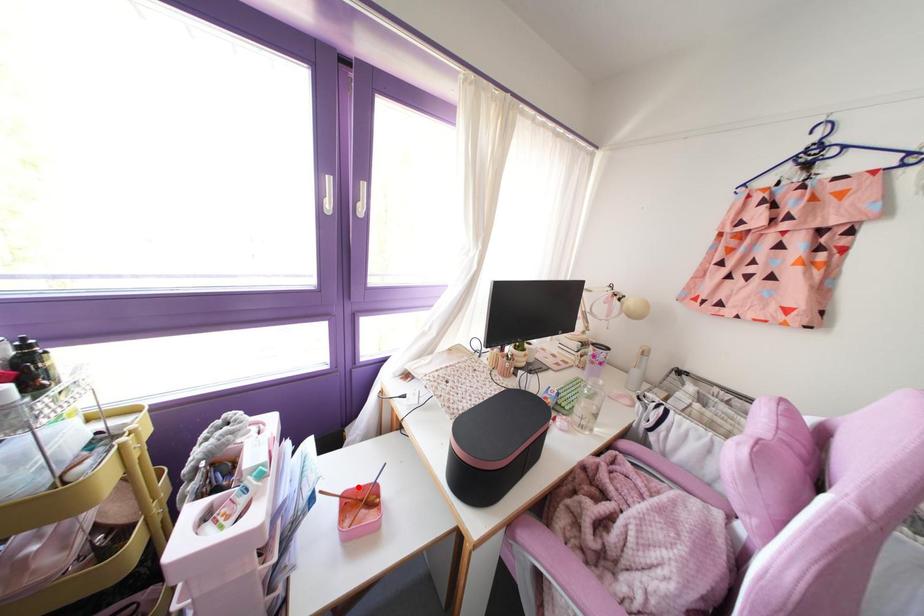
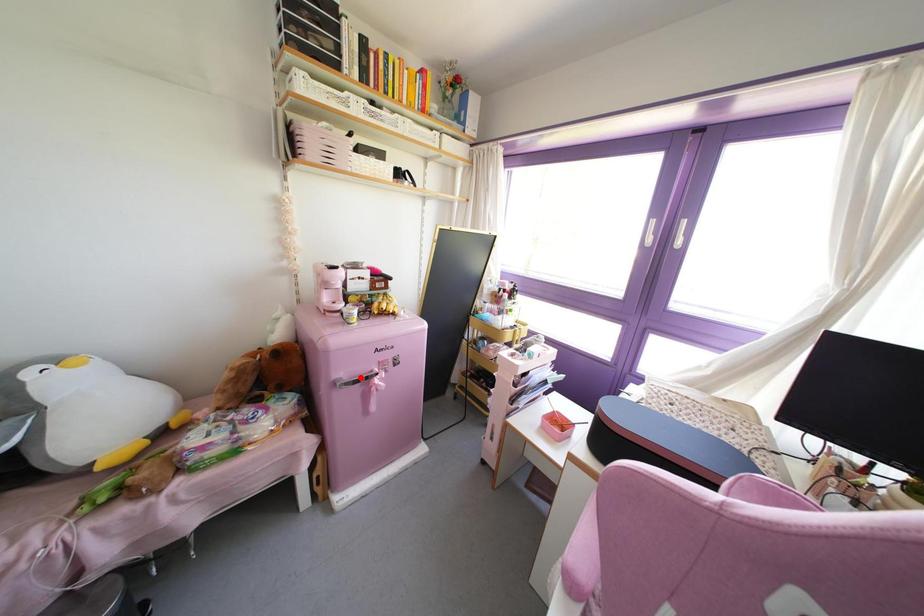
I am providing you with two images of the same scene from different viewpoints. A red point is marked on the first image and another point is marked on the second image. Do the highlighted points in image1 and image2 indicate the same real-world spot?

No